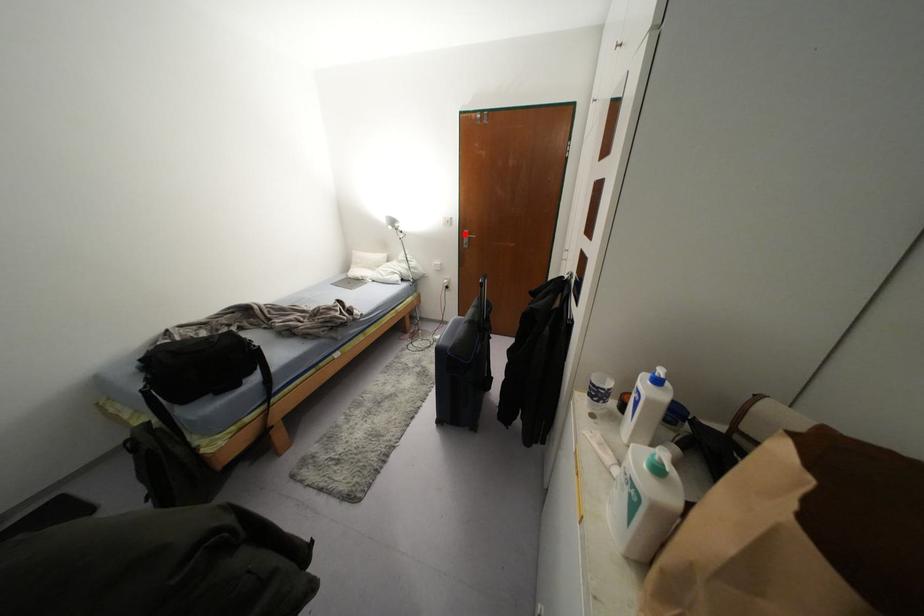
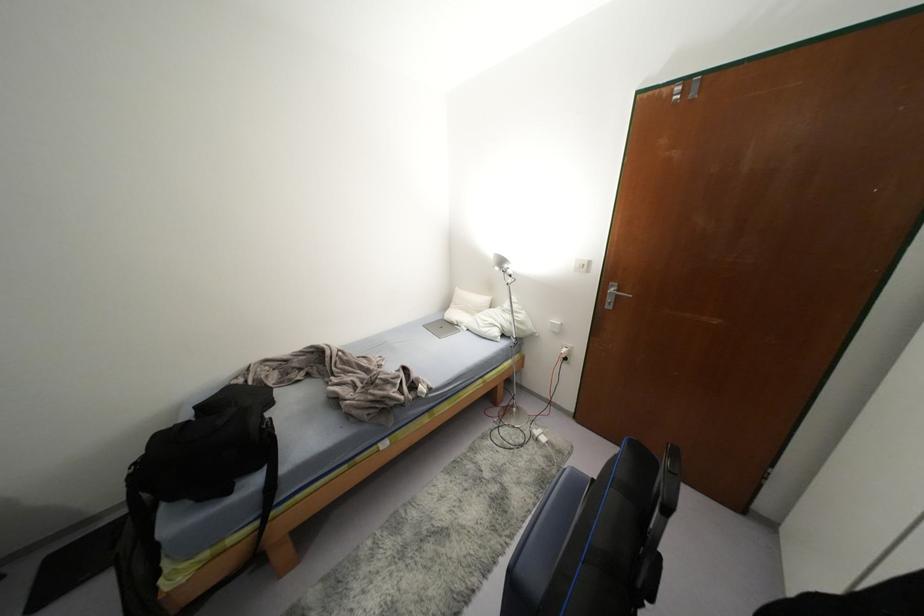
Question: I am providing you with two images of the same scene from different viewpoints. A red point is marked on the first image. At the location where the point appears in image 1, is it still visible in image 2?

Choices:
 (A) Yes
 (B) No

Answer: (A)